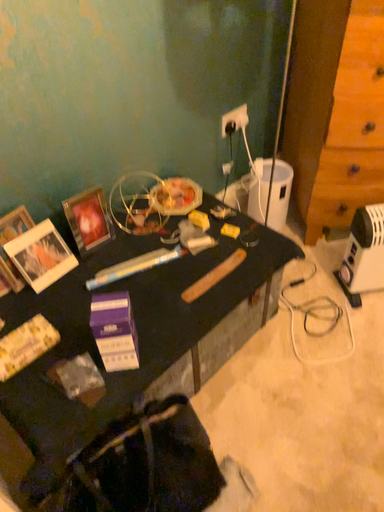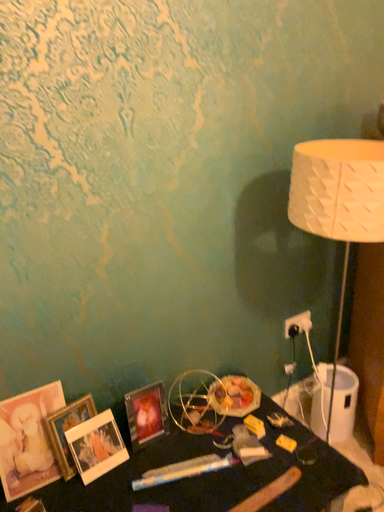
Question: Which way did the camera rotate in the video?

Choices:
 (A) rotated upward
 (B) rotated downward

Answer: (A)